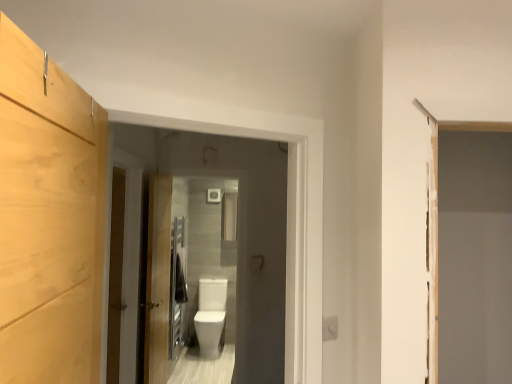
Question: Is point (122, 319) closer or farther from the camera than point (118, 196)?

Choices:
 (A) farther
 (B) closer

Answer: (A)

Question: In terms of height, does wooden door at center, acting as the second door starting from the right, look taller or shorter compared to wooden barn door at left?

Choices:
 (A) short
 (B) tall

Answer: (B)

Question: Which is nearer to the wooden door at center, the first door positioned from the right?

Choices:
 (A) wooden door at center, acting as the 1th door starting from the front
 (B) white glossy toilet bowl at center
 (C) light wood cabinet at left
 (D) white glossy toilet at center
 (E) wooden barn door at left

Answer: (A)

Question: Based on their relative distances, which object is nearer to the wooden door at center, acting as the second door starting from the right?

Choices:
 (A) wooden barn door at left
 (B) light wood cabinet at left
 (C) white glossy toilet bowl at center
 (D) wooden door at center, the first door positioned from the right
 (E) white glossy toilet at center

Answer: (A)